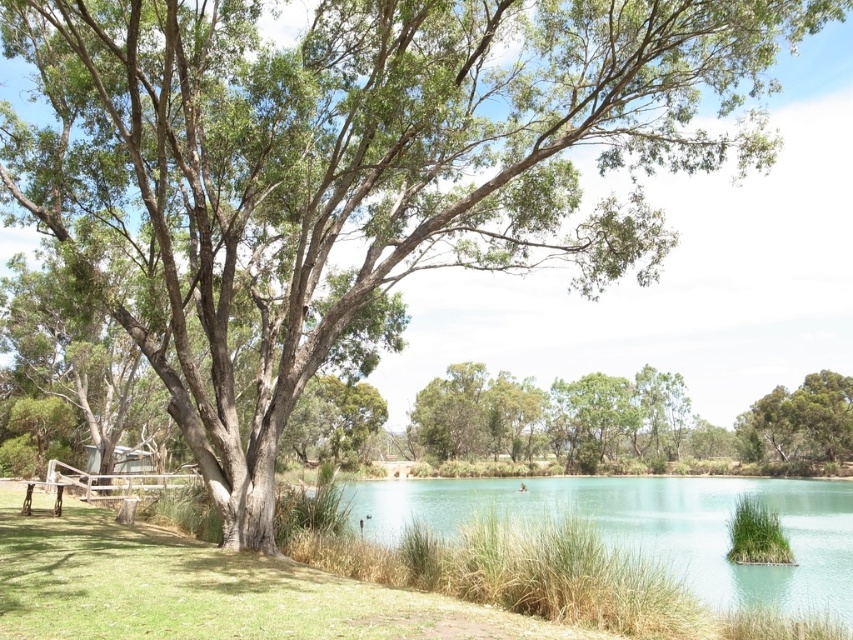
You are planning to set up a picnic area in this scene. You have a picnic blanket that is 2 meters wide. You want to place it either on the clear blue water at center or the green grass at lower right. Which location can accommodate the blanket without folding it?

The clear blue water at center has a greater width than the green grass at lower right. Since the blanket is 2 meters wide, it would fit better on the clear blue water at center where there is more space.

You are standing at the point with coordinates point (799, 420) in the scene. Based on the description, what object are you most likely standing on?

The point (799, 420) corresponds to the green leafy tree at center, so you are most likely standing on the green leafy tree at center.

You are a hiker standing at the base of the green leafy tree at center. You want to reach the clear blue water at center. Which direction should you walk to get there?

The clear blue water at center is to the left of the green leafy tree at center, so you should walk to the left to reach it.